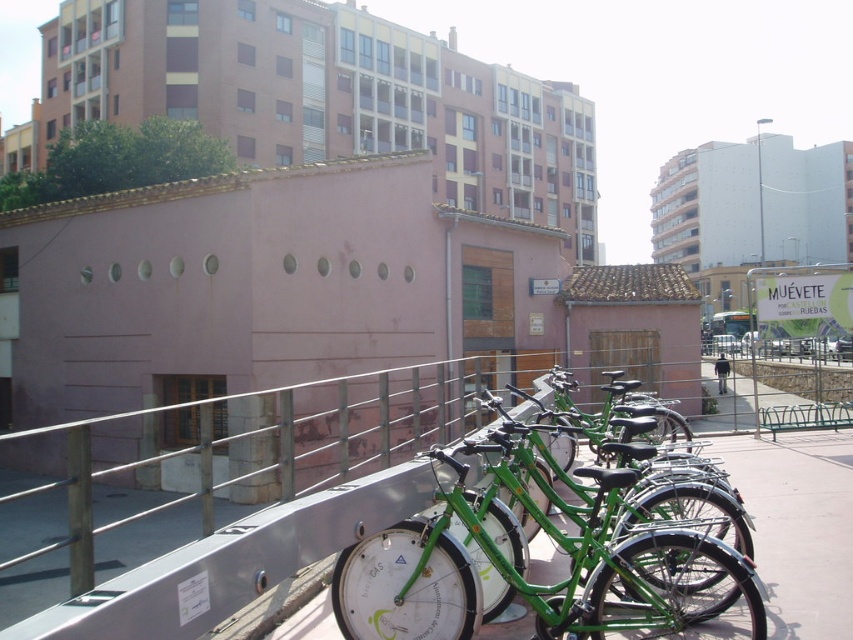
You are a delivery person needing to carry a black fabric jacket at center while riding the green matte bicycle at center. Can you safely carry the jacket on the bicycle without it getting in the way?

The green matte bicycle at center is thinner than the black fabric jacket at center, so the jacket might be too wide to fit comfortably on the bicycle. It could get in the way while riding.